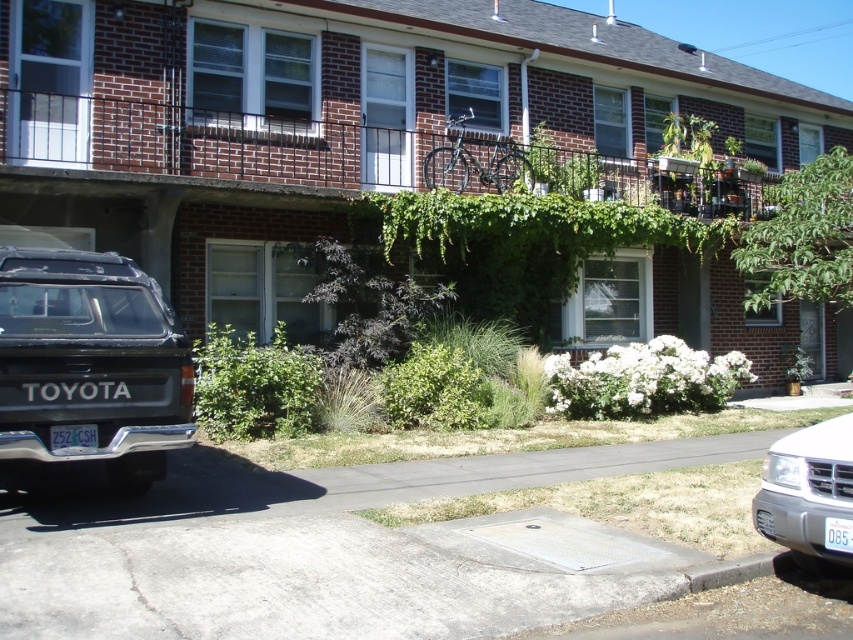
Is white matte suv at lower right to the left of white plastic license plate at lower left from the viewer's perspective?

No, white matte suv at lower right is not to the left of white plastic license plate at lower left.

Is white matte suv at lower right positioned behind white plastic license plate at lower left?

That is False.

This screenshot has height=640, width=853. What do you see at coordinates (809, 493) in the screenshot? I see `white matte suv at lower right` at bounding box center [809, 493].

Locate an element on the screen. white matte suv at lower right is located at coordinates (809, 493).

From the picture: Which of these two, matte black suv at lower left or white plastic license plate at lower left, stands taller?

matte black suv at lower left is taller.

Is matte black suv at lower left positioned behind white plastic license plate at lower left?

That is False.

Which is in front, point (12, 374) or point (73, 432)?

Point (12, 374)

Where is `matte black suv at lower left`? The width and height of the screenshot is (853, 640). matte black suv at lower left is located at coordinates (90, 364).

Can you confirm if matte black suv at lower left is positioned to the left of white plastic license plate at lower right?

Yes, matte black suv at lower left is to the left of white plastic license plate at lower right.

In order to click on matte black suv at lower left in this screenshot , I will do `click(90, 364)`.